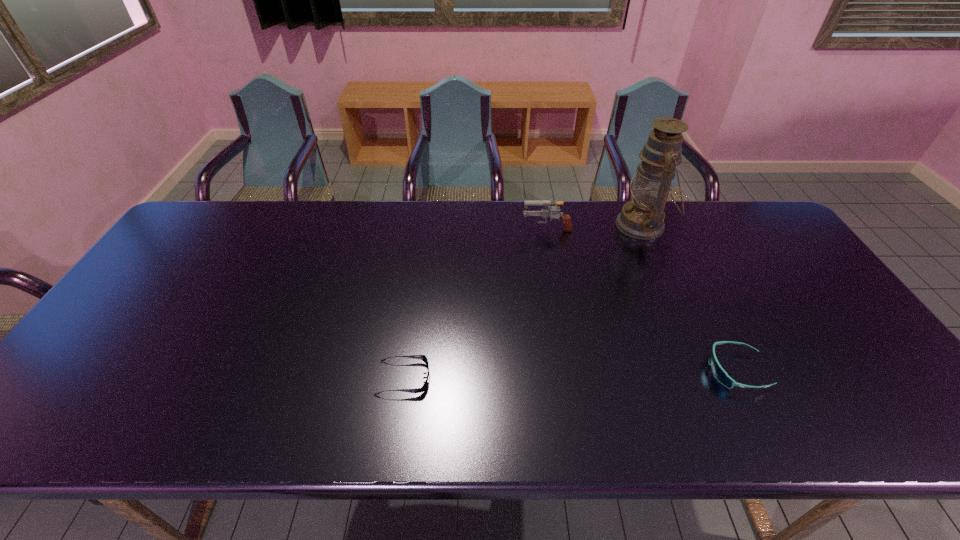
I want to click on empty space that is in between the shortest object and the taller sunglasses, so click(570, 374).

Locate an element on the screen. The image size is (960, 540). vacant space that's between the right sunglasses and the left sunglasses is located at coordinates (570, 374).

The height and width of the screenshot is (540, 960). Find the location of `free area in between the second shortest object and the oil lamp`. free area in between the second shortest object and the oil lamp is located at coordinates (689, 298).

Choose which object is the third nearest neighbor to the shortest object. Please provide its 2D coordinates. Your answer should be formatted as a tuple, i.e. [(x, y)], where the tuple contains the x and y coordinates of a point satisfying the conditions above.

[(643, 218)]

This screenshot has width=960, height=540. I want to click on object that is the closest one to the shortest object, so click(545, 213).